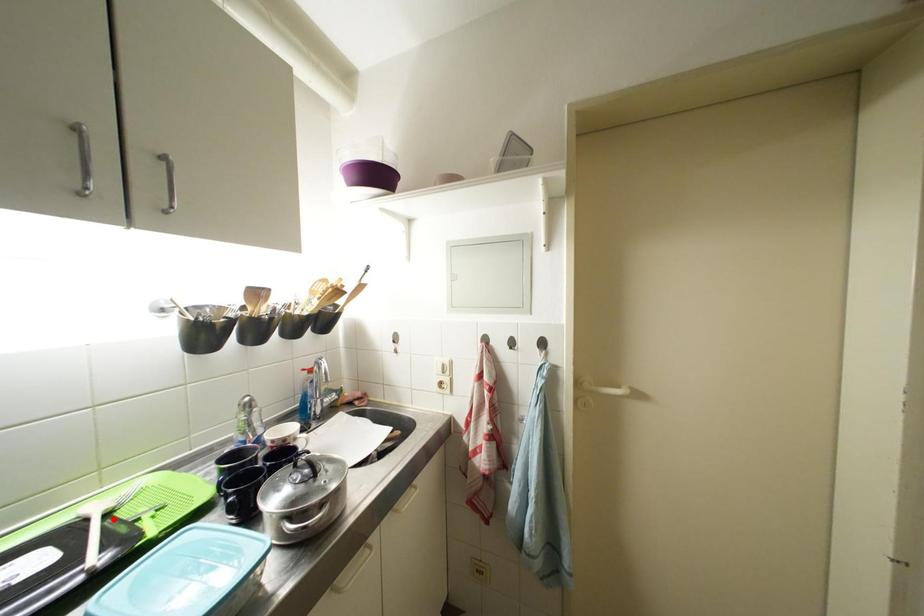
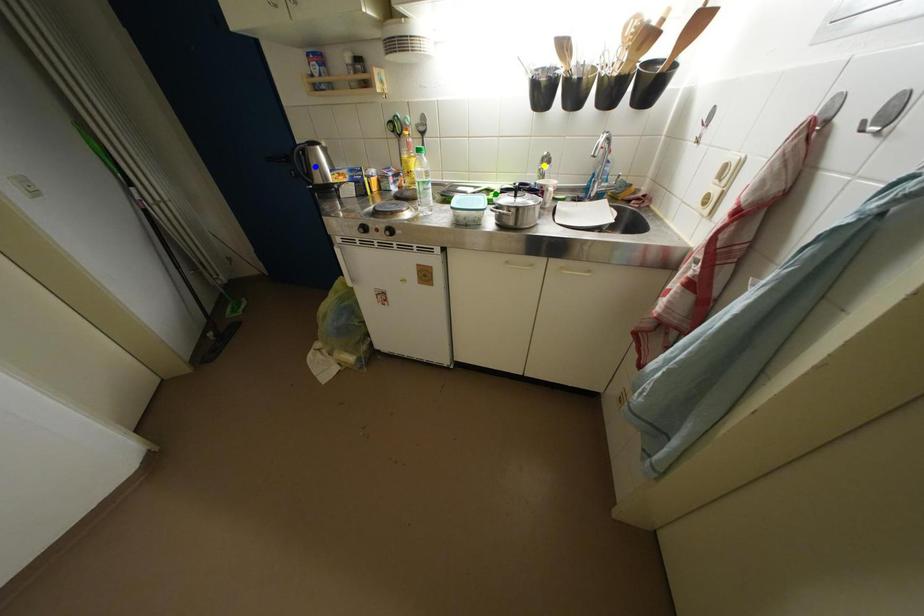
Question: I am providing you with two images of the same scene from different viewpoints. A red point is marked on the first image. You are given multiple points on the second image. Which spot in image 2 lines up with the point in image 1?

Choices:
 (A) yellow point
 (B) green point
 (C) blue point

Answer: (B)